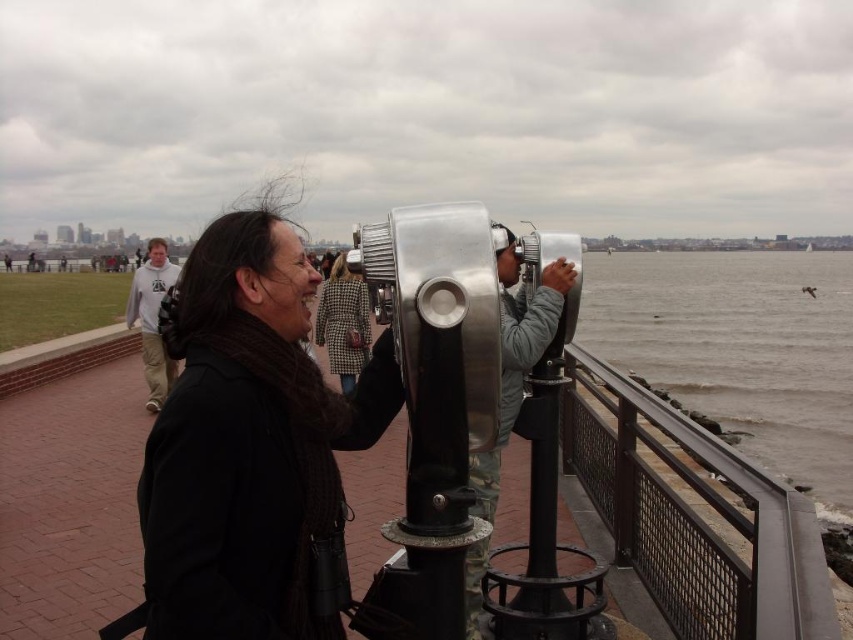
Question: Does black wool scarf at center appear under houndstooth fabric coat at center?

Choices:
 (A) yes
 (B) no

Answer: (A)

Question: Which object is the closest to the light gray hoodie at center?

Choices:
 (A) houndstooth fabric coat at center
 (B) black wool scarf at center

Answer: (A)

Question: Which object is the farthest from the light gray hoodie at center?

Choices:
 (A) metallic gray binoculars at center
 (B) houndstooth fabric coat at center
 (C) black wool scarf at center

Answer: (C)

Question: Is metallic gray binoculars at center below houndstooth fabric coat at center?

Choices:
 (A) yes
 (B) no

Answer: (A)

Question: Is the position of black wool scarf at center more distant than that of metallic gray binoculars at center?

Choices:
 (A) yes
 (B) no

Answer: (B)

Question: Which of these objects is positioned farthest from the black wool scarf at center?

Choices:
 (A) metallic gray binoculars at center
 (B) light gray hoodie at center
 (C) houndstooth fabric coat at center

Answer: (B)